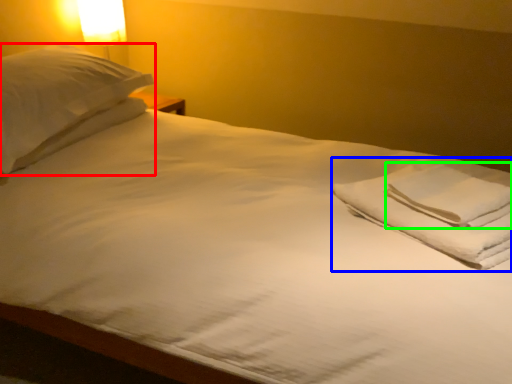
Question: Which object is positioned closest to pillow (highlighted by a red box)? Select from material (highlighted by a blue box) and hand towel (highlighted by a green box).

Choices:
 (A) material
 (B) hand towel

Answer: (A)